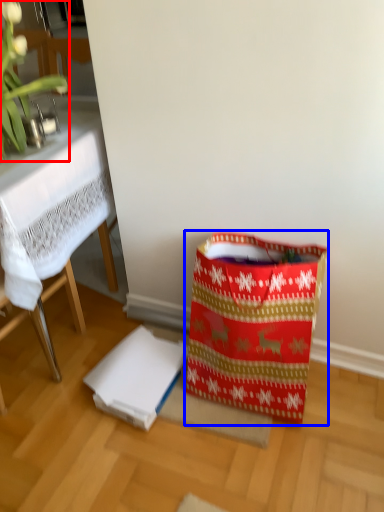
Question: Which object is closer to the camera taking this photo, orchid (highlighted by a red box) or shopping bag (highlighted by a blue box)?

Choices:
 (A) orchid
 (B) shopping bag

Answer: (A)